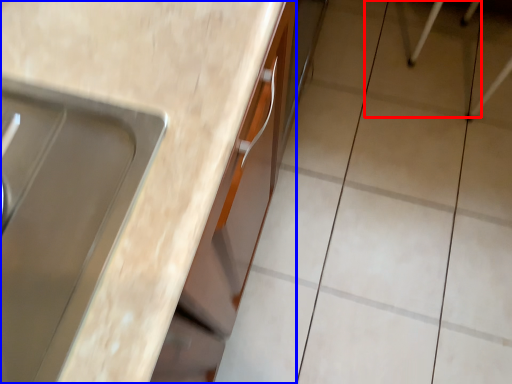
Question: Which object appears closest to the camera in this image, ceramic tile (highlighted by a red box) or countertop (highlighted by a blue box)?

Choices:
 (A) ceramic tile
 (B) countertop

Answer: (B)